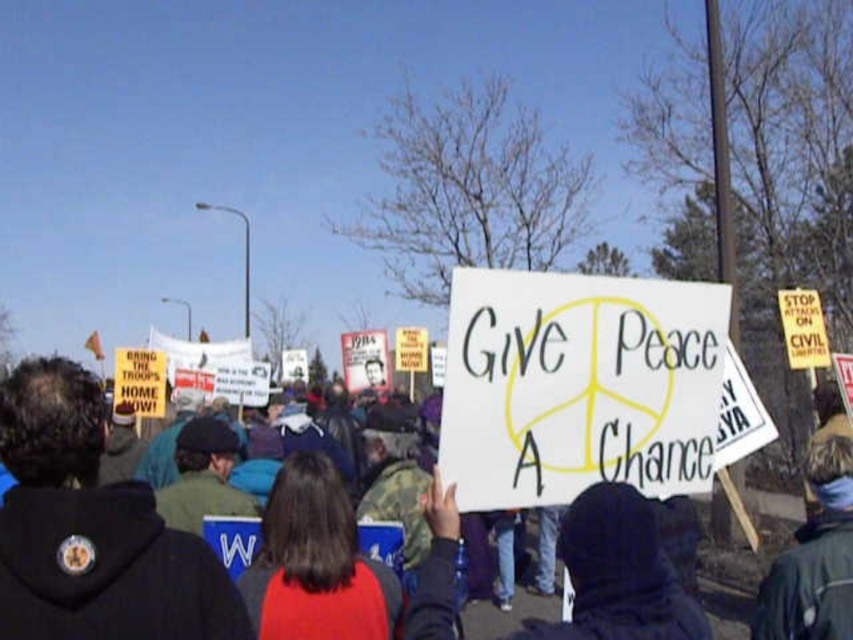
Can you confirm if white paper sign at center is wider than dark blue hoodie at center?

Yes, white paper sign at center is wider than dark blue hoodie at center.

Which of these two, white paper sign at center or dark blue hoodie at center, stands shorter?

dark blue hoodie at center is shorter.

Does point (471, 461) come behind point (28, 508)?

Yes, it is.

Identify the location of white paper sign at center. The width and height of the screenshot is (853, 640). (578, 385).